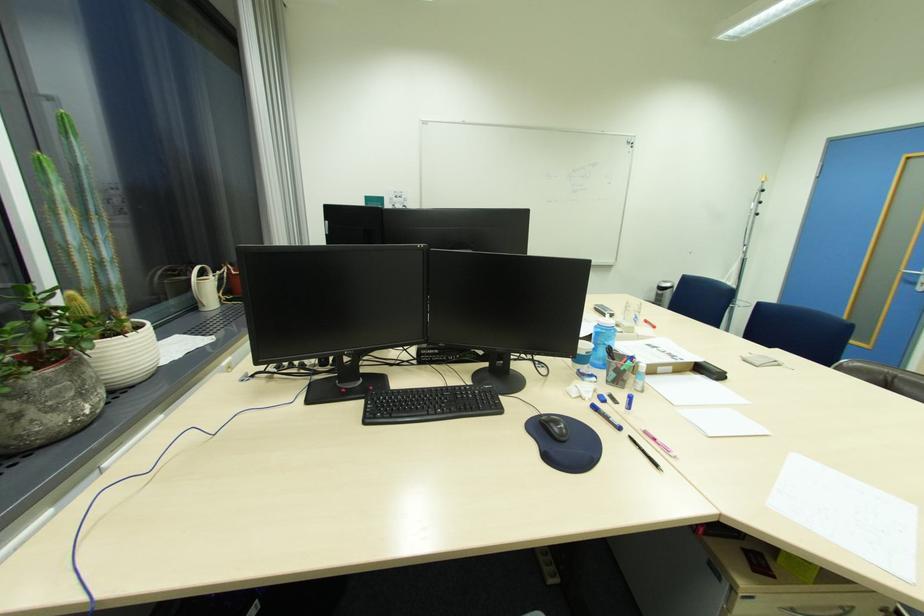
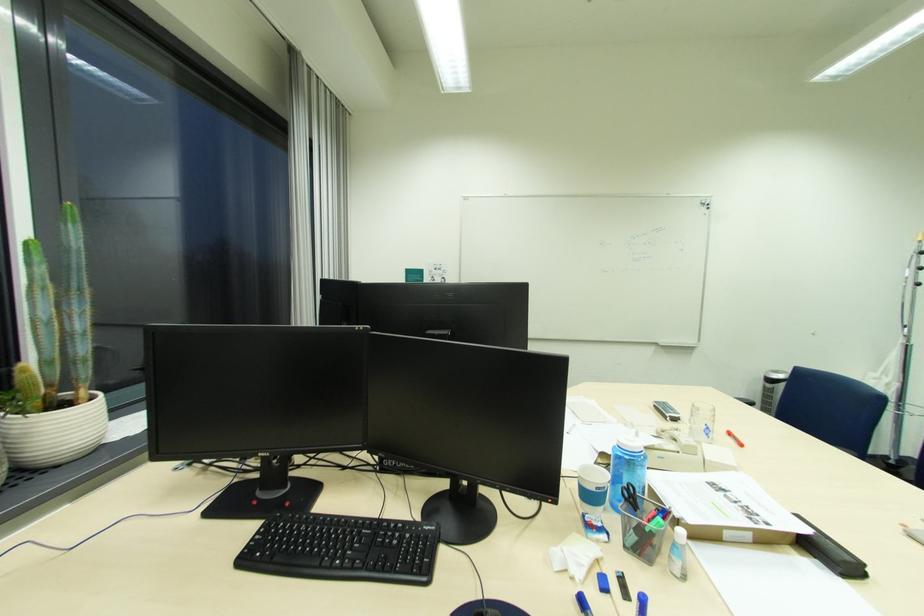
Where in the second image is the point corresponding to [708,374] from the first image?

(821, 557)